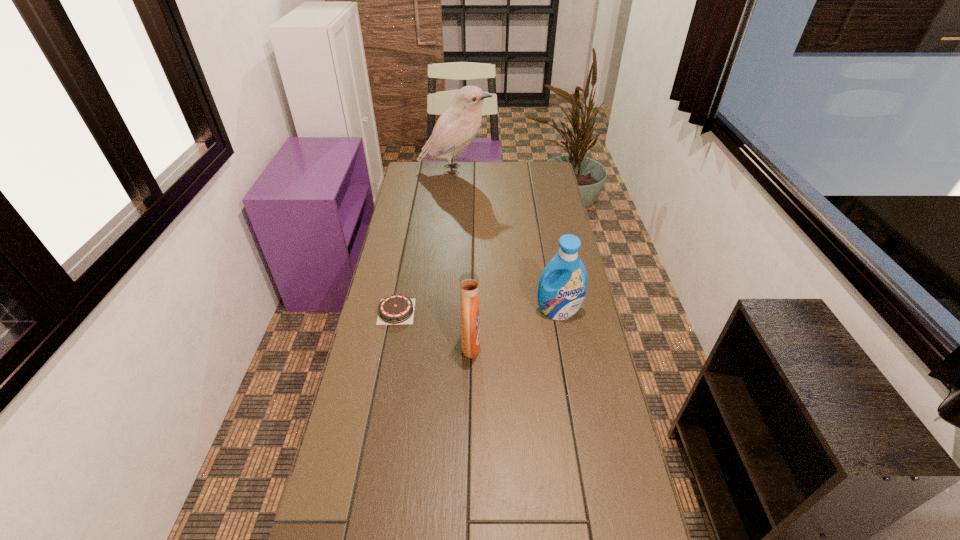
Identify the location of free space between the nearer detergent and the farther detergent. This screenshot has width=960, height=540. (515, 328).

The height and width of the screenshot is (540, 960). Identify the location of free space that is in between the chocolate cake and the nearest object. (434, 328).

At what (x,y) coordinates should I click in order to perform the action: click on free space between the farthest object and the nearest object. Please return your answer as a coordinate pair (x, y). Image resolution: width=960 pixels, height=540 pixels. Looking at the image, I should click on (463, 258).

You are a GUI agent. You are given a task and a screenshot of the screen. Output one action in this format:
    pyautogui.click(x=<x>, y=<y>)
    Task: Click on the vacant space that's between the nearest object and the chocolate cake
    The image size is (960, 540).
    Given the screenshot: What is the action you would take?
    [x=434, y=328]

At what (x,y) coordinates should I click in order to perform the action: click on vacant space that is in between the nearest object and the parakeet. Please return your answer as a coordinate pair (x, y). Looking at the image, I should click on (463, 258).

The image size is (960, 540). I want to click on free spot between the shortest object and the left detergent, so click(x=434, y=328).

This screenshot has height=540, width=960. Identify the location of vacant region between the chocolate cake and the farthest object. (425, 240).

Locate an element on the screen. vacant space that is in between the tallest object and the right detergent is located at coordinates (507, 240).

Find the location of a particular element. The width and height of the screenshot is (960, 540). vacant space in between the left detergent and the tallest object is located at coordinates (463, 258).

Identify the location of the closest object to the right detergent. (469, 282).